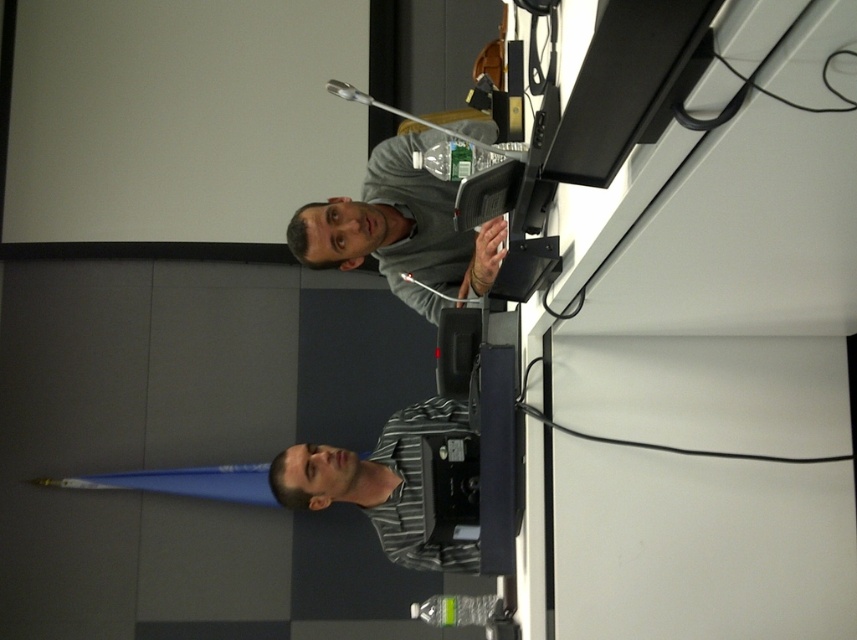
The image size is (857, 640). I want to click on gray matte jacket at upper center, so click(x=400, y=228).

Who is more distant from viewer, [382,232] or [274,483]?

Point [274,483]

At what (x,y) coordinates should I click in order to perform the action: click on gray matte jacket at upper center. Please return your answer as a coordinate pair (x, y). Image resolution: width=857 pixels, height=640 pixels. Looking at the image, I should click on (400, 228).